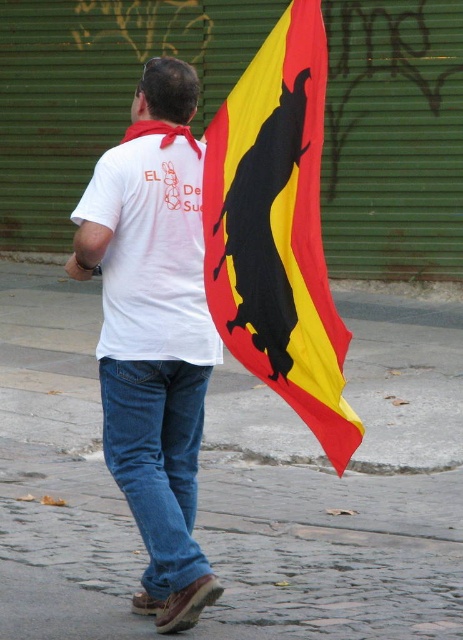
Question: Which of the following is the closest to the observer?

Choices:
 (A) white cotton shirt at center
 (B) yellow fabric flag at center
 (C) white cotton t-shirt at back
 (D) denim jeans at lower center

Answer: (B)

Question: From the image, what is the correct spatial relationship of cobblestone pavement at center in relation to denim jeans at lower center?

Choices:
 (A) right
 (B) left

Answer: (A)

Question: Does cobblestone pavement at center appear on the left side of denim jeans at lower center?

Choices:
 (A) no
 (B) yes

Answer: (A)

Question: Is yellow fabric flag at center closer to the viewer compared to white cotton t-shirt at back?

Choices:
 (A) no
 (B) yes

Answer: (B)

Question: Which object appears farthest from the camera in this image?

Choices:
 (A) denim jeans at lower center
 (B) yellow fabric flag at center

Answer: (A)

Question: Which point is farther to the camera?

Choices:
 (A) (176, 406)
 (B) (296, 152)
 (C) (62, 365)
 (D) (139, 378)

Answer: (C)